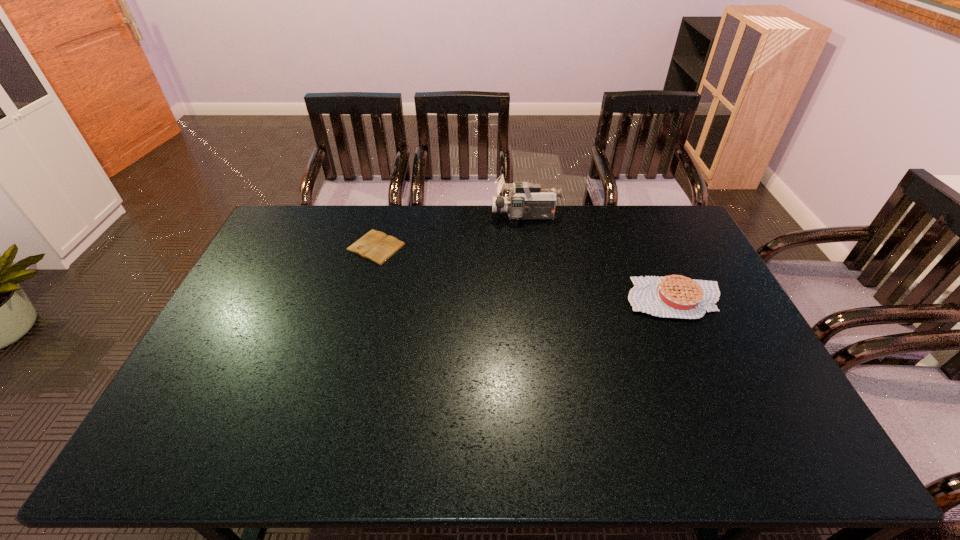
Identify the location of the tallest object. This screenshot has width=960, height=540. (527, 201).

This screenshot has height=540, width=960. Identify the location of the farthest object. (x=527, y=201).

You are a GUI agent. You are given a task and a screenshot of the screen. Output one action in this format:
    pyautogui.click(x=<x>, y=<y>)
    Task: Click on the pie
    This screenshot has width=960, height=540.
    Given the screenshot: What is the action you would take?
    pyautogui.click(x=675, y=296)

Identify the location of the second tallest object. This screenshot has height=540, width=960. (675, 296).

Where is `book`? This screenshot has height=540, width=960. book is located at coordinates click(x=376, y=246).

The image size is (960, 540). Identify the location of the second nearest object. (376, 246).

The width and height of the screenshot is (960, 540). I want to click on vacant space located 0.270m on the front-facing side of the farthest object, so click(422, 216).

Identify the location of vacant space located on the front-facing side of the farthest object. (471, 216).

Where is `vacant space positioned on the front-facing side of the farthest object`? The width and height of the screenshot is (960, 540). vacant space positioned on the front-facing side of the farthest object is located at coordinates (398, 216).

Identify the location of free spot located on the back of the pie. The image size is (960, 540). (640, 220).